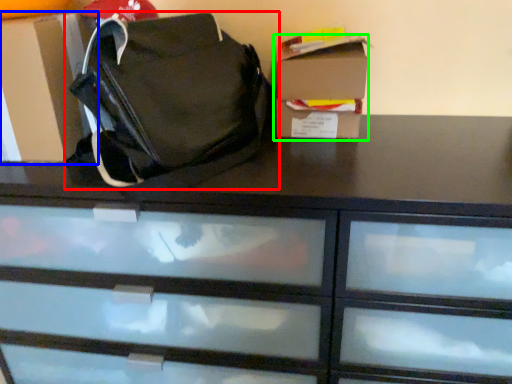
Question: Considering the real-world distances, which object is closest to handbag (highlighted by a red box)? cardboard box (highlighted by a blue box) or storage box (highlighted by a green box).

Choices:
 (A) cardboard box
 (B) storage box

Answer: (A)